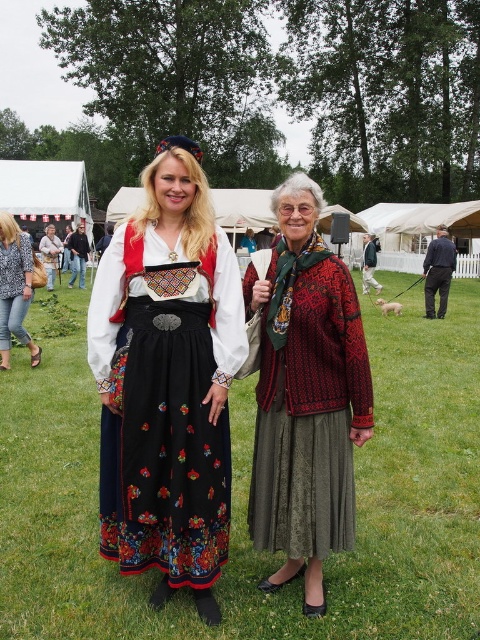
Is point (103, 484) positioned before point (451, 257)?

Yes, point (103, 484) is closer to viewer.

Between point (186, 180) and point (425, 285), which one is positioned in front?

Point (186, 180) is in front.

The width and height of the screenshot is (480, 640). Find the location of `floral-patterned fabric dress at center`. floral-patterned fabric dress at center is located at coordinates (168, 380).

Does point (17, 276) come in front of point (439, 262)?

Yes, it is in front of point (439, 262).

Between denim jeans at lower left and dark gray wool pants at right, which one is positioned lower?

Positioned lower is denim jeans at lower left.

Locate an element on the screen. The height and width of the screenshot is (640, 480). denim jeans at lower left is located at coordinates (14, 289).

Is green grass at center to the left of dark gray wool pants at right from the viewer's perspective?

Yes, green grass at center is to the left of dark gray wool pants at right.

Is point (361, 515) less distant than point (439, 248)?

That is True.

Describe the element at coordinates (247, 499) in the screenshot. I see `green grass at center` at that location.

This screenshot has width=480, height=640. I want to click on green grass at center, so click(247, 499).